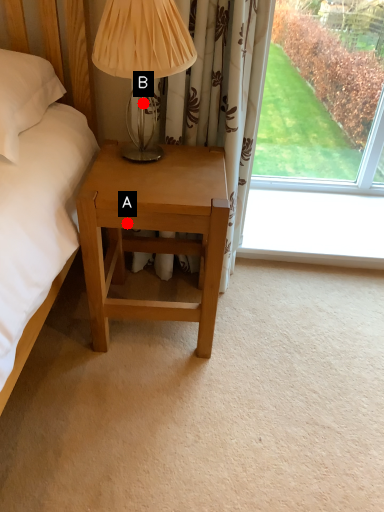
Question: Two points are circled on the image, labeled by A and B beside each circle. Which of the following is the closest to the observer?

Choices:
 (A) A is closer
 (B) B is closer

Answer: (A)